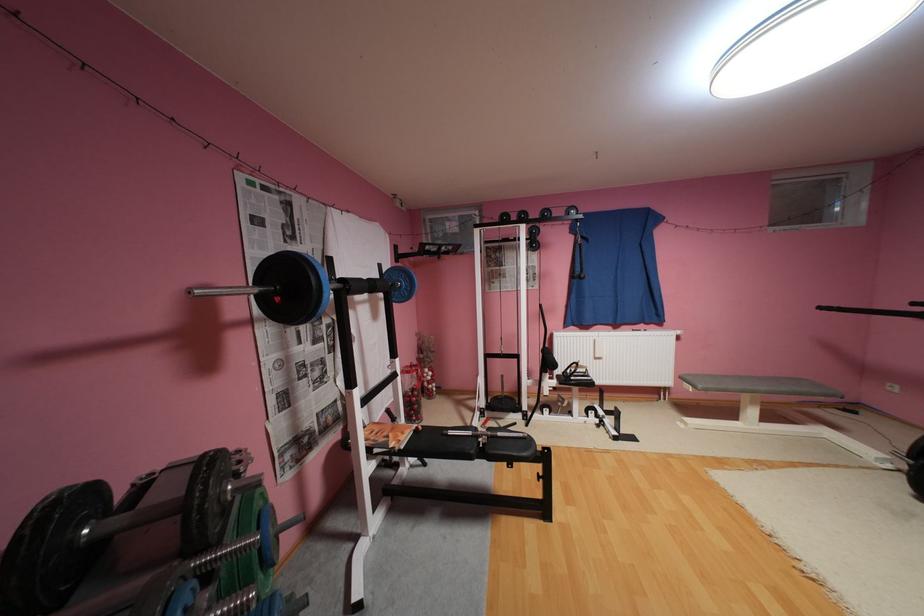
Describe the element at coordinates (760, 386) in the screenshot. I see `the grey bench sitting surface` at that location.